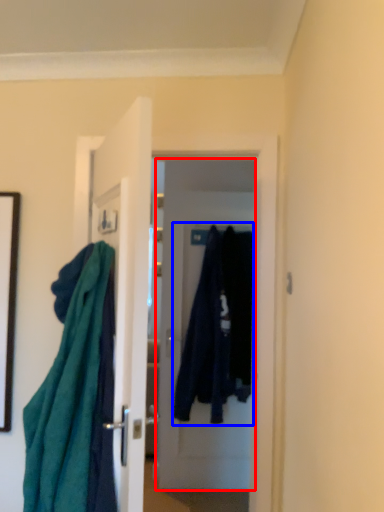
Question: Which object is further to the camera taking this photo, door (highlighted by a red box) or clothing (highlighted by a blue box)?

Choices:
 (A) door
 (B) clothing

Answer: (A)